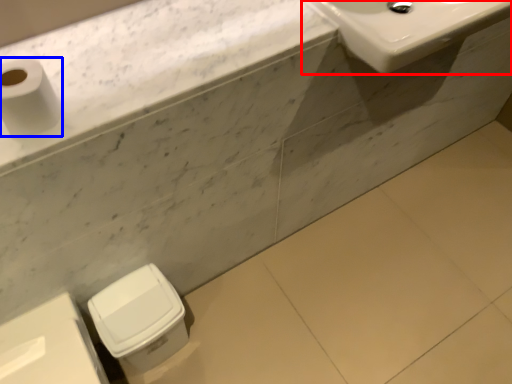
Question: Which of the following is the closest to the observer, sink (highlighted by a red box) or toilet paper (highlighted by a blue box)?

Choices:
 (A) sink
 (B) toilet paper

Answer: (B)